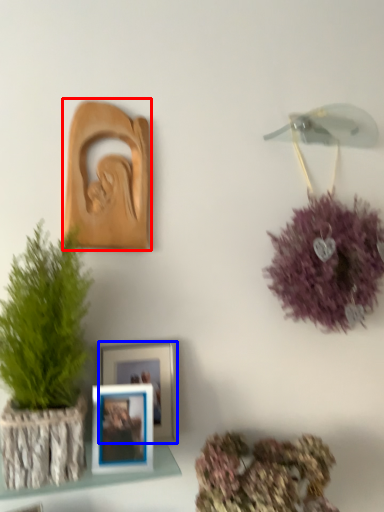
Question: Which object is closer to the camera taking this photo, picture frame (highlighted by a red box) or picture frame (highlighted by a blue box)?

Choices:
 (A) picture frame
 (B) picture frame

Answer: (B)